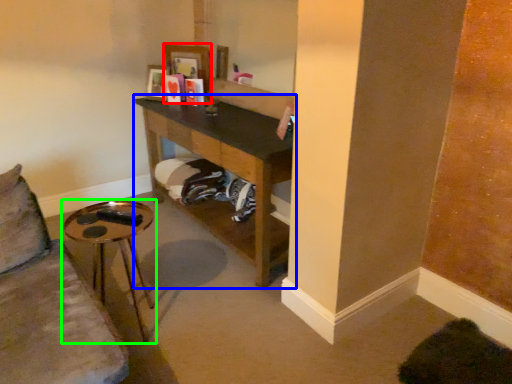
Question: Estimate the real-world distances between objects in this image. Which object is farther from picture frame (highlighted by a red box), shelf (highlighted by a blue box) or table (highlighted by a green box)?

Choices:
 (A) shelf
 (B) table

Answer: (B)